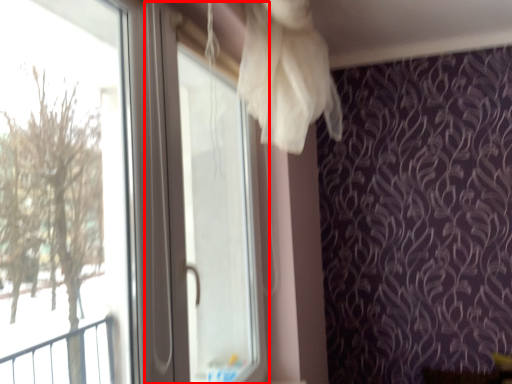
Question: From the image's perspective, where is screen door (annotated by the red box) located relative to window?

Choices:
 (A) above
 (B) below

Answer: (B)